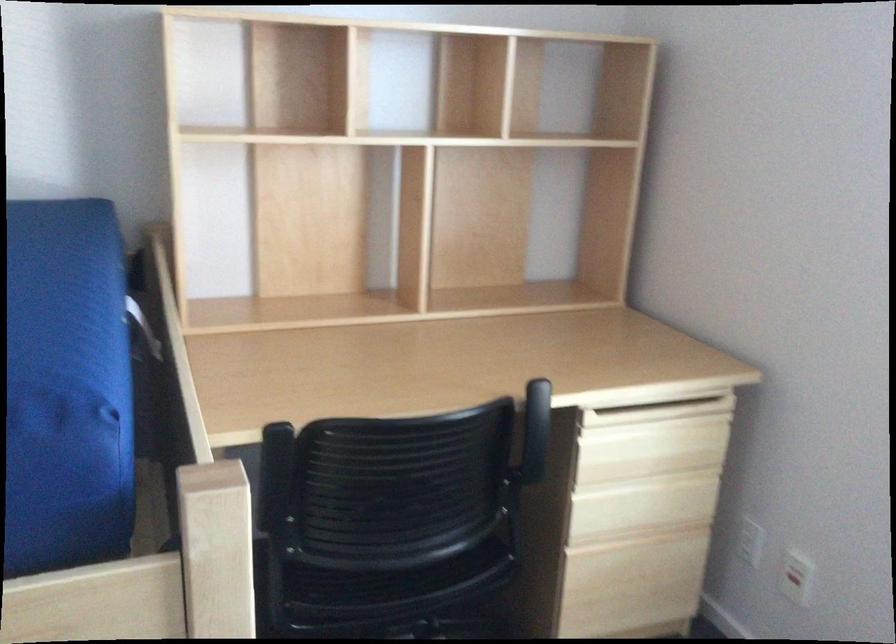
Identify the location of blue sofa sitting surface. This screenshot has width=896, height=644. (66, 388).